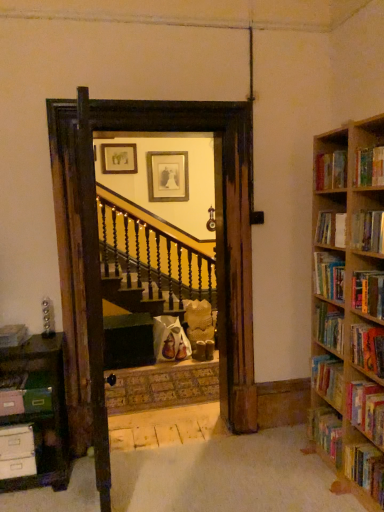
You are a GUI agent. You are given a task and a screenshot of the screen. Output one action in this format:
    pyautogui.click(x=<x>, y=<y>)
    Task: Click on the free space above matte pink book at left, the 2th book when ordered from left to right (from a real-world perspective)
    This screenshot has height=512, width=384.
    Given the screenshot: What is the action you would take?
    pyautogui.click(x=10, y=377)